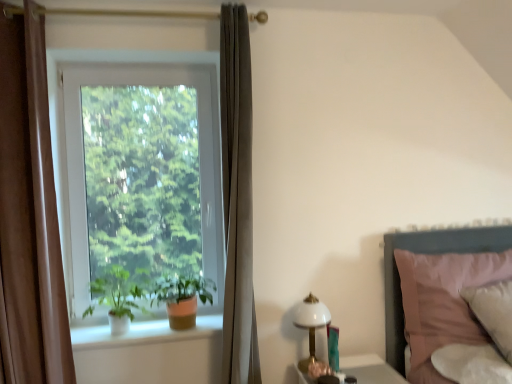
Question: From a real-world perspective, is white glass lampshade at right physically above white matte plant at window, the first houseplant when ordered from left to right?

Choices:
 (A) yes
 (B) no

Answer: (B)

Question: Does white glass lampshade at right lie in front of white matte plant at window, which is the second houseplant in right-to-left order?

Choices:
 (A) no
 (B) yes

Answer: (A)

Question: Is white glass lampshade at right oriented towards white matte plant at window, the first houseplant when ordered from left to right?

Choices:
 (A) yes
 (B) no

Answer: (B)

Question: Considering the relative sizes of white glass lampshade at right and white matte plant at window, the first houseplant when ordered from left to right, in the image provided, is white glass lampshade at right bigger than white matte plant at window, the first houseplant when ordered from left to right,?

Choices:
 (A) no
 (B) yes

Answer: (A)

Question: Is white glass lampshade at right positioned with its back to white matte plant at window, which is the second houseplant in right-to-left order?

Choices:
 (A) yes
 (B) no

Answer: (B)

Question: Can you confirm if white glass lampshade at right is positioned to the left of white matte plant at window, the first houseplant when ordered from left to right?

Choices:
 (A) no
 (B) yes

Answer: (A)

Question: Does pink fabric bed at right appear on the right side of white glass lampshade at right?

Choices:
 (A) no
 (B) yes

Answer: (B)

Question: Could you tell me if pink fabric bed at right is facing white glass lampshade at right?

Choices:
 (A) no
 (B) yes

Answer: (A)

Question: Is pink fabric bed at right facing away from white glass lampshade at right?

Choices:
 (A) no
 (B) yes

Answer: (A)

Question: Considering the relative sizes of pink fabric bed at right and white glass lampshade at right in the image provided, is pink fabric bed at right bigger than white glass lampshade at right?

Choices:
 (A) no
 (B) yes

Answer: (B)

Question: Is pink fabric bed at right positioned behind white glass lampshade at right?

Choices:
 (A) no
 (B) yes

Answer: (A)

Question: Does pink fabric bed at right have a smaller size compared to white glass lampshade at right?

Choices:
 (A) yes
 (B) no

Answer: (B)

Question: Is white glass lampshade at right thinner than pink fabric bed at right?

Choices:
 (A) yes
 (B) no

Answer: (A)